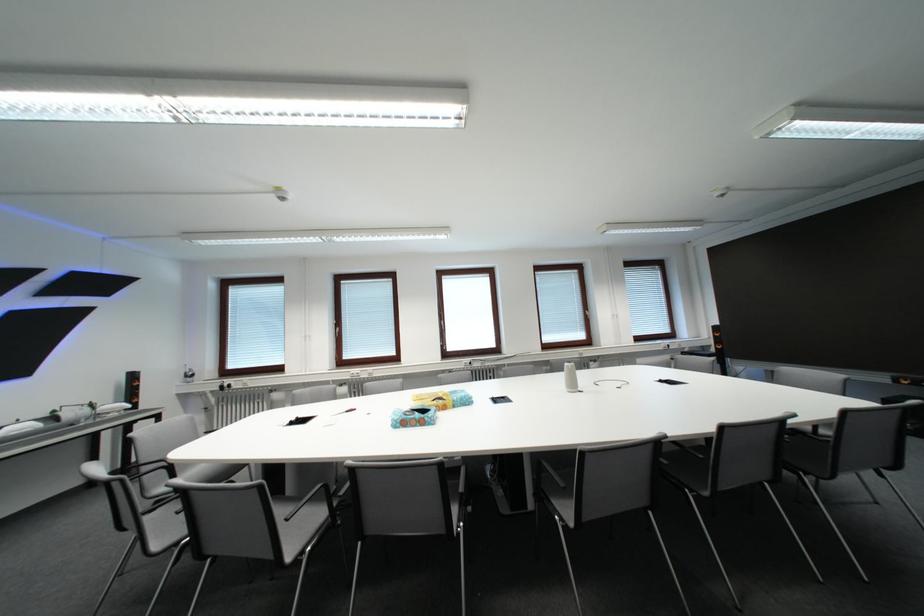
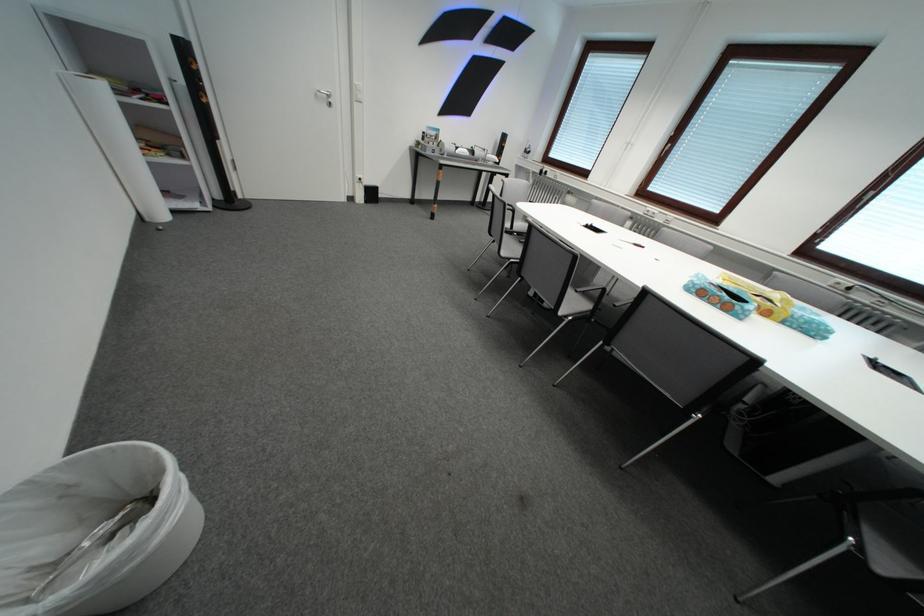
The point at (187, 546) is marked in the first image. Where is the corresponding point in the second image?

(519, 262)